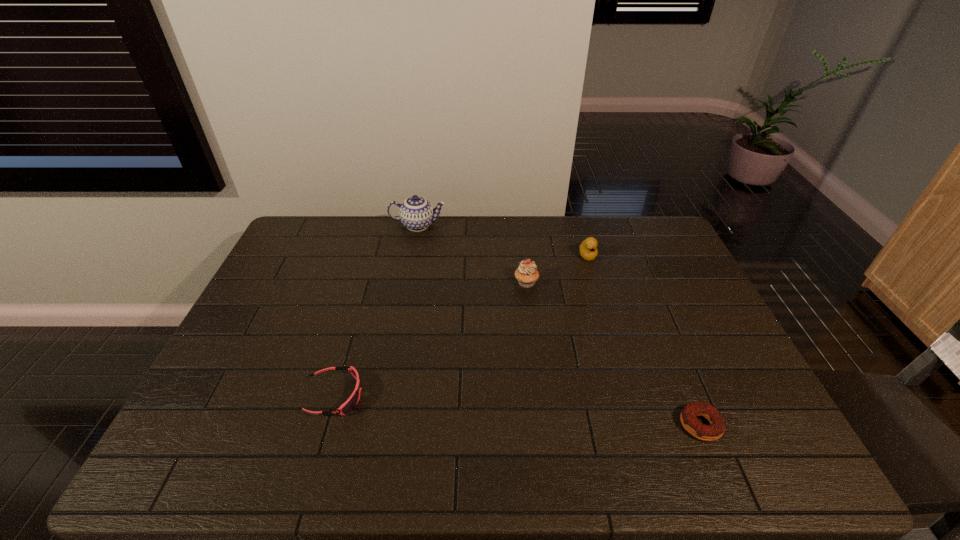
The width and height of the screenshot is (960, 540). What are the coordinates of `vacant space located 0.360m on the front of the third object from right to left` in the screenshot? It's located at (539, 387).

The height and width of the screenshot is (540, 960). I want to click on free space located 0.380m on the face of the fourth object from left to right, so tap(616, 352).

Identify the location of free region located 0.240m on the front-facing side of the goggles. (458, 396).

This screenshot has height=540, width=960. What are the coordinates of `free space located 0.350m on the left of the shortest object` in the screenshot? It's located at [x=532, y=425].

The height and width of the screenshot is (540, 960). I want to click on chinaware present at the far edge, so click(x=416, y=213).

This screenshot has width=960, height=540. Find the location of `duckling at the far edge`. duckling at the far edge is located at coordinates (588, 251).

Image resolution: width=960 pixels, height=540 pixels. Identify the location of object that is at the near edge. (688, 416).

This screenshot has width=960, height=540. Find the location of `object located in the right edge section of the desktop`. object located in the right edge section of the desktop is located at coordinates (688, 416).

You are a GUI agent. You are given a task and a screenshot of the screen. Output one action in this format:
    pyautogui.click(x=<x>, y=<y>)
    Task: Click on the object at the near right corner
    The height and width of the screenshot is (540, 960).
    Given the screenshot: What is the action you would take?
    pyautogui.click(x=688, y=416)

You are a GUI agent. You are given a task and a screenshot of the screen. Output one action in this format:
    pyautogui.click(x=<x>, y=<y>)
    Task: Click on the free space at the far edge of the desktop
    This screenshot has width=960, height=540.
    Given the screenshot: What is the action you would take?
    pyautogui.click(x=573, y=230)